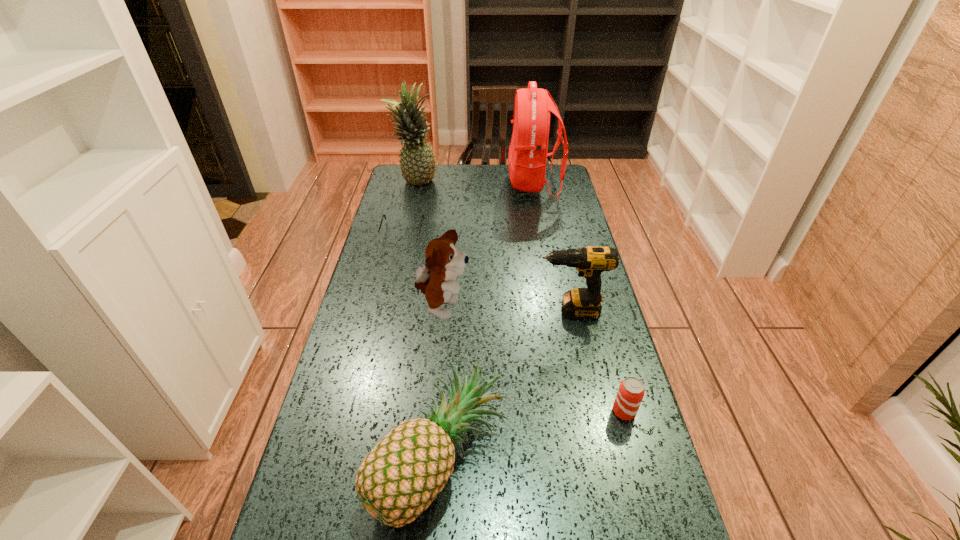
Find the location of a particular element. This screenshot has height=540, width=960. free space located 0.380m on the right of the farther pineapple is located at coordinates (525, 183).

The image size is (960, 540). Identify the location of free region located on the face of the puppy. (523, 309).

In order to click on free spot located at the tip of the drill in this screenshot , I will do `click(422, 311)`.

Where is `free location located at the tip of the drill`? free location located at the tip of the drill is located at coordinates (429, 311).

Find the location of `blank space located at the tip of the drill`. blank space located at the tip of the drill is located at coordinates (506, 311).

You are a GUI agent. You are given a task and a screenshot of the screen. Output one action in this format:
    pyautogui.click(x=<x>, y=<y>)
    Task: Click on the free spot located on the back of the beer can
    This screenshot has width=960, height=540.
    Given the screenshot: What is the action you would take?
    pyautogui.click(x=612, y=368)

The width and height of the screenshot is (960, 540). What are the coordinates of `free location located at the hinge ends of the spectacles` in the screenshot? It's located at (385, 308).

Find the location of a particular element. backpack positioned at the far edge is located at coordinates (527, 158).

You are a GUI agent. You are given a task and a screenshot of the screen. Output one action in this format:
    pyautogui.click(x=<x>, y=<y>)
    Task: Click on the pineapple at the far edge
    This screenshot has height=540, width=960.
    Given the screenshot: What is the action you would take?
    pyautogui.click(x=417, y=161)

Find the location of a particular element. This screenshot has height=540, width=960. pineapple present at the left edge is located at coordinates 417,161.